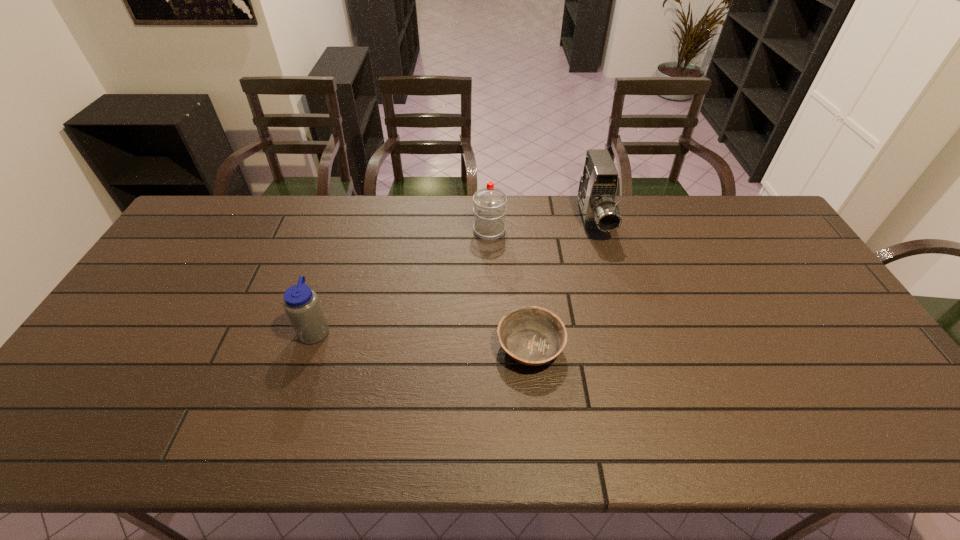
Locate an element on the screen. The width and height of the screenshot is (960, 540). vacant space located with a carrying loop on the side of the left water bottle is located at coordinates click(400, 330).

I want to click on vacant region located 0.120m on the back of the shortest object, so click(x=524, y=288).

Where is `camcorder that is at the far edge`? The height and width of the screenshot is (540, 960). camcorder that is at the far edge is located at coordinates (598, 185).

Find the location of a particular element. The image size is (960, 540). water bottle located at the far edge is located at coordinates (489, 209).

You are a GUI agent. You are given a task and a screenshot of the screen. Output one action in this format:
    pyautogui.click(x=<x>, y=<y>)
    Task: Click on the free region at the far edge of the desktop
    The height and width of the screenshot is (540, 960).
    Given the screenshot: What is the action you would take?
    pyautogui.click(x=320, y=200)

This screenshot has height=540, width=960. In the image, there is a desktop. Identify the location of vacant space at the near edge. (198, 448).

Locate an element on the screen. vacant space at the left edge of the desktop is located at coordinates (112, 359).

This screenshot has height=540, width=960. In the image, there is a desktop. Find the location of `free region at the near left corner`. free region at the near left corner is located at coordinates (92, 428).

Identify the location of blank region between the nearer water bottle and the bowl. The height and width of the screenshot is (540, 960). (422, 339).

You are a GUI agent. You are given a task and a screenshot of the screen. Output one action in this format:
    pyautogui.click(x=<x>, y=<y>)
    Task: Click on the vacant area that lies between the taller water bottle and the left water bottle
    
    Given the screenshot: What is the action you would take?
    pyautogui.click(x=402, y=280)